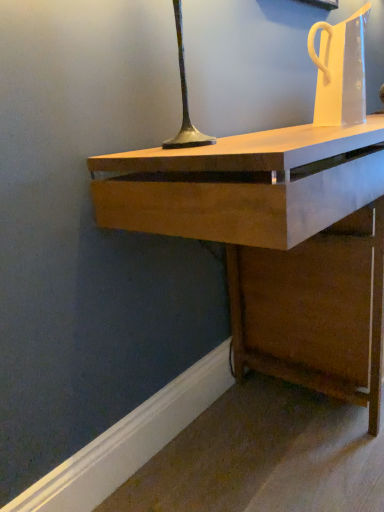
Question: From a real-world perspective, is wooden desk at center above or below transparent plastic jug at upper right?

Choices:
 (A) below
 (B) above

Answer: (A)

Question: Relative to transparent plastic jug at upper right, is wooden desk at center in front or behind?

Choices:
 (A) behind
 (B) front

Answer: (B)

Question: Visually, is wooden desk at center positioned to the left or to the right of transparent plastic jug at upper right?

Choices:
 (A) right
 (B) left

Answer: (A)

Question: From the image's perspective, is transparent plastic jug at upper right positioned above or below wooden desk at center?

Choices:
 (A) below
 (B) above

Answer: (B)

Question: Which is correct: transparent plastic jug at upper right is inside wooden desk at center, or outside of it?

Choices:
 (A) outside
 (B) inside

Answer: (A)

Question: Looking at the image, does transparent plastic jug at upper right seem bigger or smaller compared to wooden desk at center?

Choices:
 (A) small
 (B) big

Answer: (A)

Question: From a real-world perspective, relative to wooden desk at center, is transparent plastic jug at upper right vertically above or below?

Choices:
 (A) above
 (B) below

Answer: (A)